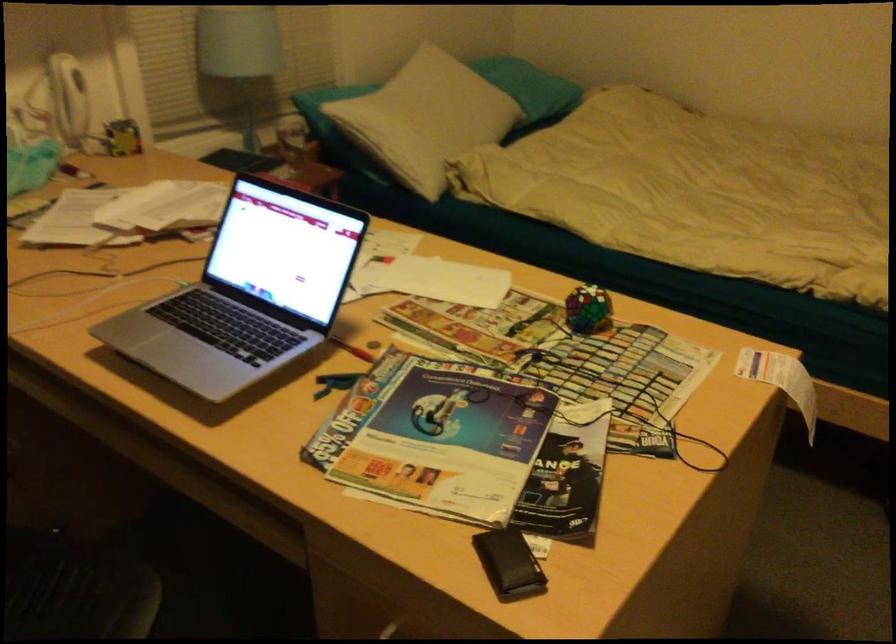
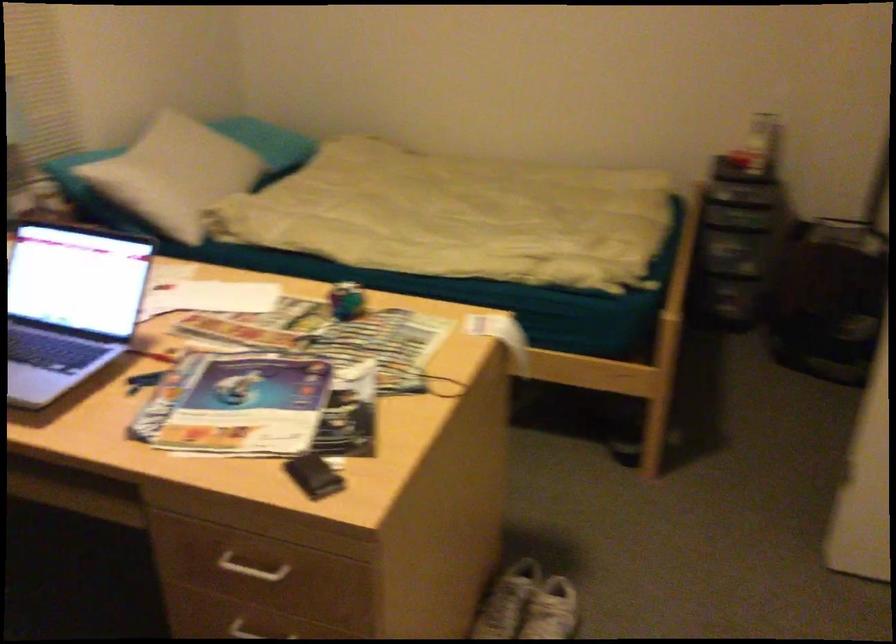
Question: The camera is either moving clockwise (left) or counter-clockwise (right) around the object. The first image is from the beginning of the video and the second image is from the end. Is the camera moving left or right when shooting the video?

Choices:
 (A) Left
 (B) Right

Answer: (A)